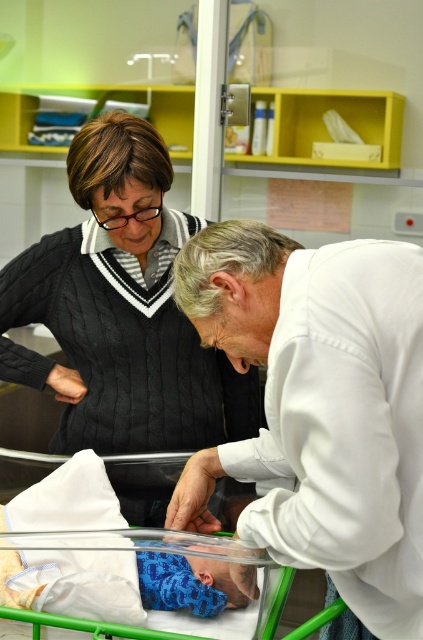
Question: Is black cable-knit sweater at upper left above blue knitted fabric at center?

Choices:
 (A) yes
 (B) no

Answer: (A)

Question: Can you confirm if black cable-knit sweater at upper left is smaller than blue knitted fabric at center?

Choices:
 (A) yes
 (B) no

Answer: (B)

Question: Considering the real-world distances, which object is closest to the blue knitted fabric at center?

Choices:
 (A) white smooth coat at center
 (B) black cable-knit sweater at upper left

Answer: (A)

Question: Which object is positioned closest to the black cable-knit sweater at upper left?

Choices:
 (A) white smooth coat at center
 (B) blue knitted fabric at center

Answer: (A)

Question: Considering the real-world distances, which object is farthest from the white smooth coat at center?

Choices:
 (A) blue knitted fabric at center
 (B) black cable-knit sweater at upper left

Answer: (B)

Question: Considering the relative positions of white smooth coat at center and black cable-knit sweater at upper left in the image provided, where is white smooth coat at center located with respect to black cable-knit sweater at upper left?

Choices:
 (A) left
 (B) right

Answer: (B)